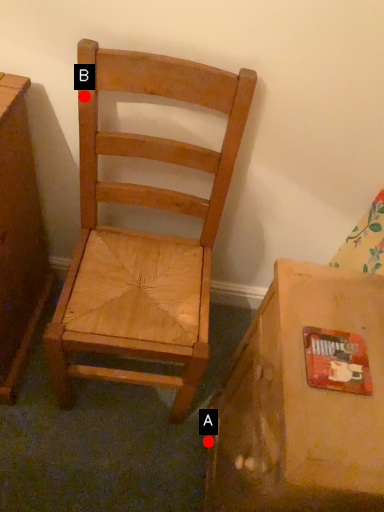
Question: Two points are circled on the image, labeled by A and B beside each circle. Which point is closer to the camera?

Choices:
 (A) A is closer
 (B) B is closer

Answer: (B)